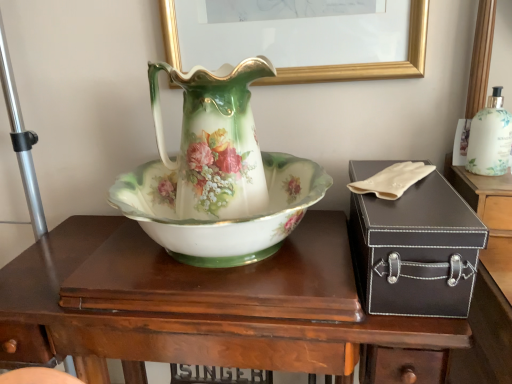
Find the location of a particular element. The height and width of the screenshot is (384, 512). porcelain floral bowl at center is located at coordinates (221, 220).

Where is `wooden desk at center`? This screenshot has height=384, width=512. wooden desk at center is located at coordinates (205, 306).

Is wooden desk at center placed right next to black leather suitcase at right?

No.

Who is smaller, wooden desk at center or black leather suitcase at right?

black leather suitcase at right is smaller.

From the image's perspective, which object appears higher, wooden desk at center or black leather suitcase at right?

black leather suitcase at right.

Does point (453, 319) lie in front of point (441, 177)?

Yes, point (453, 319) is in front of point (441, 177).

Based on the photo, is wooden desk at center completely or partially outside of porcelain floral vase at center?

Yes, wooden desk at center is not within porcelain floral vase at center.

Would you say wooden desk at center is to the left or to the right of porcelain floral vase at center in the picture?

wooden desk at center is positioned on porcelain floral vase at center's right side.

Who is taller, wooden desk at center or porcelain floral vase at center?

With more height is wooden desk at center.

From the picture: Is the position of wooden desk at center more distant than that of porcelain floral vase at center?

No, it is not.

Considering the sizes of porcelain floral bowl at center and porcelain floral vase at center in the image, is porcelain floral bowl at center wider or thinner than porcelain floral vase at center?

Clearly, porcelain floral bowl at center has more width compared to porcelain floral vase at center.

This screenshot has width=512, height=384. In order to click on vase on the left of the porcelain floral bowl at center in this screenshot , I will do `click(215, 141)`.

Does porcelain floral bowl at center appear on the left side of porcelain floral vase at center?

In fact, porcelain floral bowl at center is to the right of porcelain floral vase at center.

From a real-world perspective, is wooden desk at center physically below porcelain floral bowl at center?

Indeed, from a real-world perspective, wooden desk at center is positioned beneath porcelain floral bowl at center.

Can porcelain floral bowl at center be found inside wooden desk at center?

That's incorrect, porcelain floral bowl at center is not inside wooden desk at center.

Is wooden desk at center looking in the opposite direction of porcelain floral bowl at center?

wooden desk at center is not turned away from porcelain floral bowl at center.

Is wooden desk at center positioned before porcelain floral bowl at center?

No, wooden desk at center is further to the viewer.

Considering the relative sizes of porcelain floral vase at center and wooden desk at center in the image provided, is porcelain floral vase at center taller than wooden desk at center?

Incorrect, the height of porcelain floral vase at center is not larger of that of wooden desk at center.

Is point (228, 179) farther from camera compared to point (137, 343)?

Yes, point (228, 179) is farther from viewer.

You are a GUI agent. You are given a task and a screenshot of the screen. Output one action in this format:
    pyautogui.click(x=<x>, y=<y>)
    Task: Click on the vase behind the wooden desk at center
    The height and width of the screenshot is (384, 512).
    Given the screenshot: What is the action you would take?
    pyautogui.click(x=215, y=141)

Based on their sizes in the image, would you say porcelain floral vase at center is bigger or smaller than wooden desk at center?

In the image, porcelain floral vase at center appears to be smaller than wooden desk at center.

Is the surface of porcelain floral vase at center in direct contact with porcelain floral bowl at center?

Yes, porcelain floral vase at center is touching porcelain floral bowl at center.

How distant is porcelain floral vase at center from porcelain floral bowl at center?

porcelain floral vase at center is 3.92 inches from porcelain floral bowl at center.

Is porcelain floral vase at center facing away from porcelain floral bowl at center?

That's right, porcelain floral vase at center is facing away from porcelain floral bowl at center.

Is porcelain floral bowl at center closer to camera compared to white glossy bottle at upper right?

Yes, porcelain floral bowl at center is closer to the viewer.

Is porcelain floral bowl at center oriented away from white glossy bottle at upper right?

porcelain floral bowl at center is not turned away from white glossy bottle at upper right.

Are porcelain floral bowl at center and white glossy bottle at upper right making contact?

There is a gap between porcelain floral bowl at center and white glossy bottle at upper right.

From the image's perspective, which is below, porcelain floral bowl at center or white glossy bottle at upper right?

porcelain floral bowl at center appears lower in the image.

This screenshot has width=512, height=384. In order to click on box in front of the wooden desk at center in this screenshot , I will do `click(416, 250)`.

In the image, there is a wooden desk at center. Identify the location of vase above it (from the image's perspective). (215, 141).

From the image, which object appears to be farther from porcelain floral vase at center, porcelain floral bowl at center or black leather suitcase at right?

black leather suitcase at right lies further to porcelain floral vase at center than the other object.

Based on their spatial positions, is white glossy bottle at upper right or porcelain floral bowl at center further from wooden desk at center?

Based on the image, white glossy bottle at upper right appears to be further to wooden desk at center.

Based on their spatial positions, is black leather suitcase at right or white glossy bottle at upper right closer to porcelain floral vase at center?

The object closer to porcelain floral vase at center is black leather suitcase at right.

Considering their positions, is porcelain floral bowl at center positioned closer to porcelain floral vase at center than wooden desk at center?

porcelain floral bowl at center.

Which object lies further to the anchor point porcelain floral vase at center, wooden desk at center or black leather suitcase at right?

black leather suitcase at right lies further to porcelain floral vase at center than the other object.

Considering their positions, is black leather suitcase at right positioned closer to porcelain floral vase at center than wooden desk at center?

Among the two, wooden desk at center is located nearer to porcelain floral vase at center.

Which object lies further to the anchor point black leather suitcase at right, white glossy bottle at upper right or wooden desk at center?

Based on the image, white glossy bottle at upper right appears to be further to black leather suitcase at right.

Estimate the real-world distances between objects in this image. Which object is further from porcelain floral bowl at center, porcelain floral vase at center or wooden desk at center?

wooden desk at center is positioned further to the anchor porcelain floral bowl at center.

Where is `box between porcelain floral vase at center and wooden desk at center in the vertical direction`? The width and height of the screenshot is (512, 384). box between porcelain floral vase at center and wooden desk at center in the vertical direction is located at coordinates (416, 250).

Locate an element on the screen. This screenshot has width=512, height=384. box situated between porcelain floral bowl at center and white glossy bottle at upper right from left to right is located at coordinates (416, 250).

Identify the location of bowl between porcelain floral vase at center and wooden desk at center in the up-down direction. This screenshot has height=384, width=512. (221, 220).

Image resolution: width=512 pixels, height=384 pixels. Find the location of `bowl between porcelain floral vase at center and black leather suitcase at right in the horizontal direction`. bowl between porcelain floral vase at center and black leather suitcase at right in the horizontal direction is located at coordinates (221, 220).